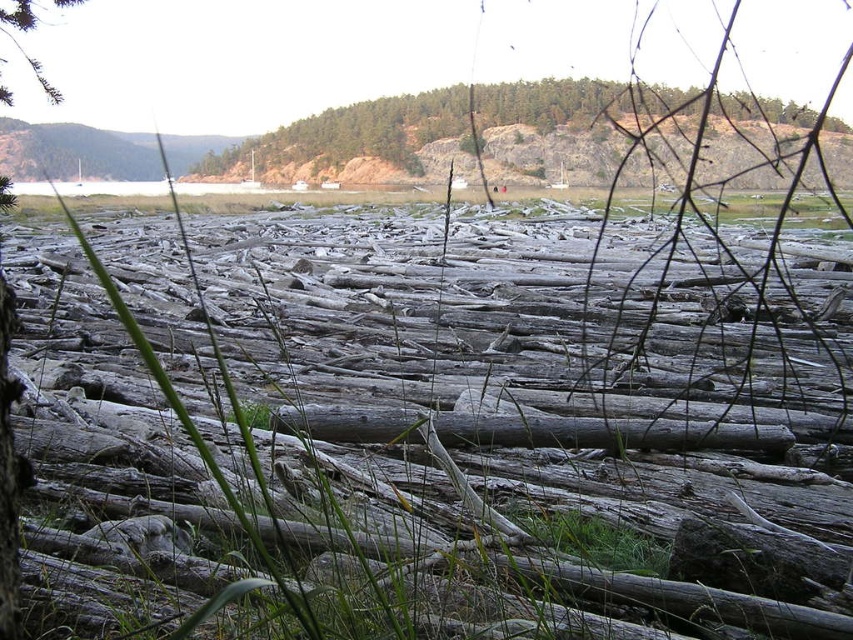
You are standing on the sandy beach looking towards the anchored sailboats. You notice the green matte grass at center and the green textured hillside at upper center. Which of these two features is closer to your eye level?

The green matte grass at center is closer to your eye level since it has a lesser height compared to the green textured hillside at upper center.

You are standing on the beach in the coastal scene and want to take a photo of the green textured hillside at upper center. Which direction should you face to capture it in your viewfinder?

The green textured hillside at upper center is located at point coordinates (439, 125), which is towards the upper center of the image. To photograph it, you should face towards the upper center direction from your position on the beach.